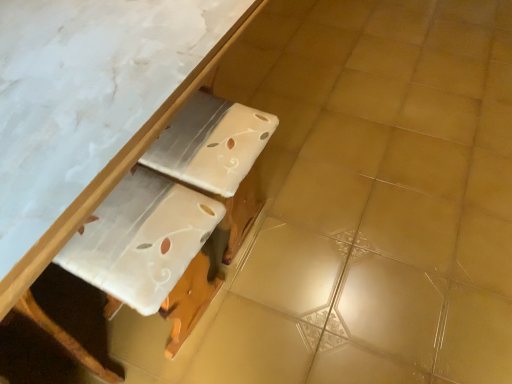
The image size is (512, 384). I want to click on vacant area situated to the left side of white glossy cardboard at center, so click(68, 323).